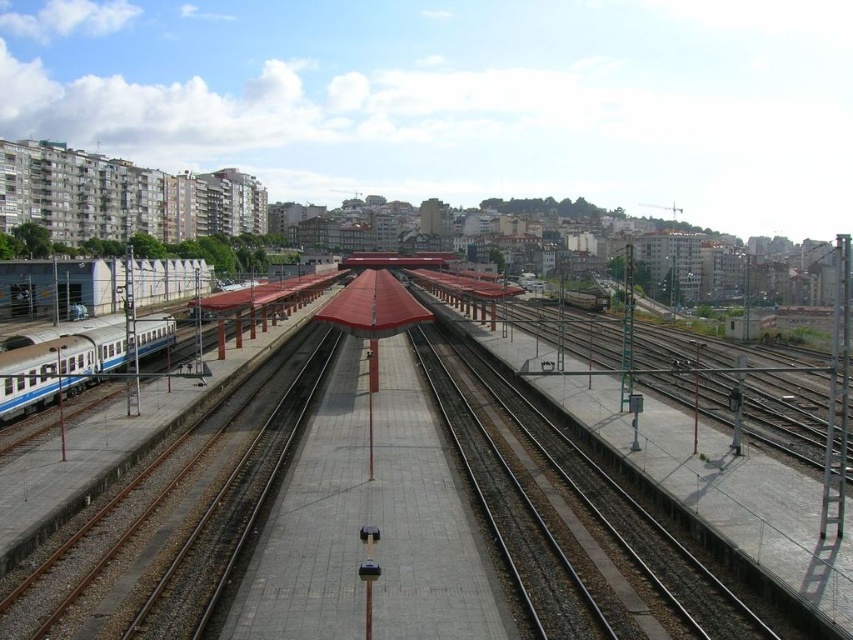
Question: Is the position of metallic train tracks at center less distant than that of smooth concrete train track at center?

Choices:
 (A) yes
 (B) no

Answer: (A)

Question: Which point is closer to the camera?

Choices:
 (A) (640, 602)
 (B) (463, 400)

Answer: (A)

Question: Where is metallic train tracks at center located in relation to smooth concrete train track at center in the image?

Choices:
 (A) below
 (B) above

Answer: (B)

Question: Which point appears closest to the camera in this image?

Choices:
 (A) (134, 352)
 (B) (196, 456)

Answer: (B)

Question: Which point is closer to the camera?

Choices:
 (A) (27, 358)
 (B) (509, 500)
 (C) (563, 592)

Answer: (C)

Question: Where is metallic train tracks at center located in relation to smooth concrete train track at center in the image?

Choices:
 (A) above
 (B) below

Answer: (A)